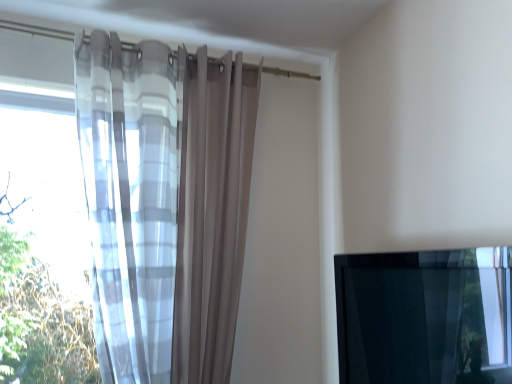
Question: Should I look upward or downward to see translucent fabric curtain at left?

Choices:
 (A) up
 (B) down

Answer: (B)

Question: Considering the relative positions of translucent fabric curtain at left and transparent glass window at lower right in the image provided, is translucent fabric curtain at left behind transparent glass window at lower right?

Choices:
 (A) yes
 (B) no

Answer: (A)

Question: Would you say translucent fabric curtain at left contains transparent glass window at lower right?

Choices:
 (A) no
 (B) yes

Answer: (A)

Question: Considering the relative sizes of translucent fabric curtain at left and transparent glass window at lower right in the image provided, is translucent fabric curtain at left shorter than transparent glass window at lower right?

Choices:
 (A) no
 (B) yes

Answer: (A)

Question: Is translucent fabric curtain at left positioned far away from transparent glass window at lower right?

Choices:
 (A) no
 (B) yes

Answer: (A)

Question: From a real-world perspective, is translucent fabric curtain at left located beneath transparent glass window at lower right?

Choices:
 (A) no
 (B) yes

Answer: (A)

Question: From a real-world perspective, is translucent fabric curtain at left on transparent glass window at lower right?

Choices:
 (A) yes
 (B) no

Answer: (A)

Question: Is transparent glass window at lower right thinner than translucent fabric curtain at left?

Choices:
 (A) yes
 (B) no

Answer: (A)

Question: Considering the relative sizes of transparent glass window at lower right and translucent fabric curtain at left in the image provided, is transparent glass window at lower right smaller than translucent fabric curtain at left?

Choices:
 (A) yes
 (B) no

Answer: (A)

Question: Is transparent glass window at lower right taller than translucent fabric curtain at left?

Choices:
 (A) yes
 (B) no

Answer: (B)

Question: Considering the relative positions of transparent glass window at lower right and translucent fabric curtain at left in the image provided, is transparent glass window at lower right to the right of translucent fabric curtain at left from the viewer's perspective?

Choices:
 (A) yes
 (B) no

Answer: (A)

Question: Would you say transparent glass window at lower right is a long distance from translucent fabric curtain at left?

Choices:
 (A) no
 (B) yes

Answer: (A)

Question: From the image's perspective, is transparent glass window at lower right above translucent fabric curtain at left?

Choices:
 (A) no
 (B) yes

Answer: (A)

Question: Is transparent glass window at lower right wider or thinner than translucent fabric curtain at left?

Choices:
 (A) thin
 (B) wide

Answer: (A)